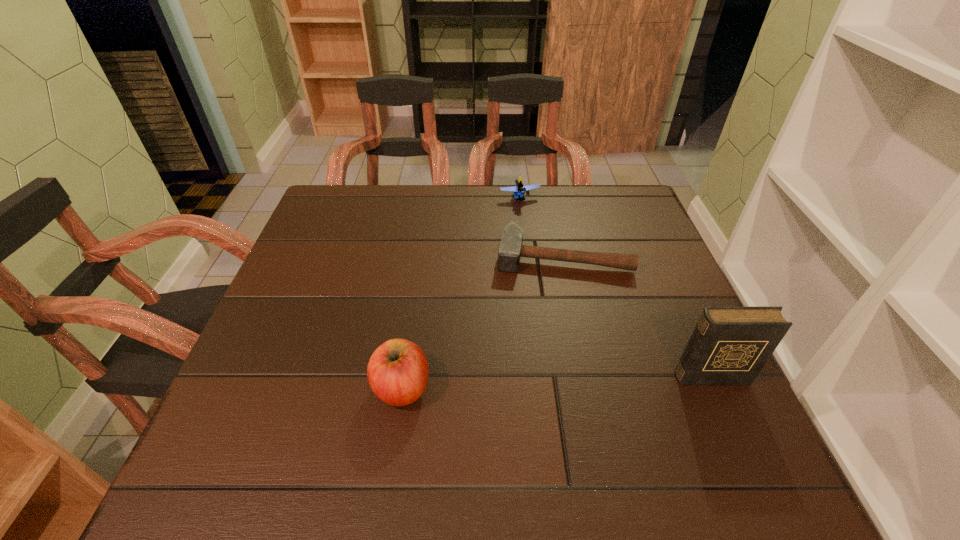
Find the location of a particular element. The width and height of the screenshot is (960, 540). apple is located at coordinates pyautogui.click(x=397, y=372).

The width and height of the screenshot is (960, 540). Find the location of `the leftmost object`. the leftmost object is located at coordinates (397, 372).

Where is `diary`? This screenshot has width=960, height=540. diary is located at coordinates (730, 345).

The image size is (960, 540). Identify the location of the rightmost object. (730, 345).

Locate an element on the screen. the farthest object is located at coordinates (519, 190).

You are a GUI agent. You are given a task and a screenshot of the screen. Output one action in this format:
    pyautogui.click(x=<x>, y=<y>)
    Task: Click on the Lego
    This screenshot has height=540, width=960.
    Given the screenshot: What is the action you would take?
    pyautogui.click(x=519, y=190)

This screenshot has height=540, width=960. What are the coordinates of `the shortest object` in the screenshot? It's located at (510, 250).

I want to click on the second farthest object, so [510, 250].

The height and width of the screenshot is (540, 960). Identify the location of free space located on the right of the apple. (540, 388).

Locate an element on the screen. The image size is (960, 540). free space located 0.070m on the front cover of the diary is located at coordinates (730, 418).